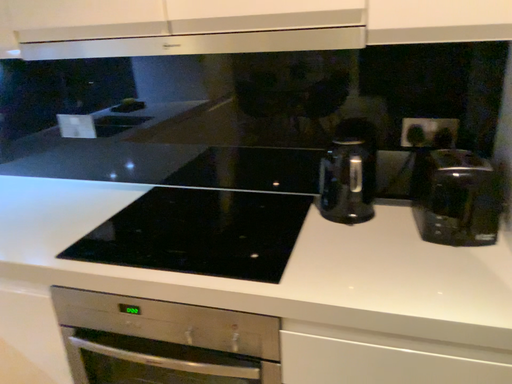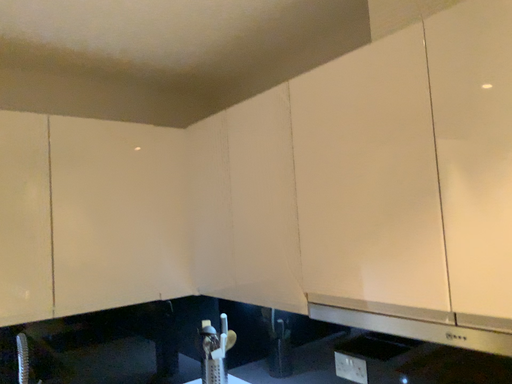
Question: Which way did the camera rotate in the video?

Choices:
 (A) rotated right
 (B) rotated left

Answer: (B)